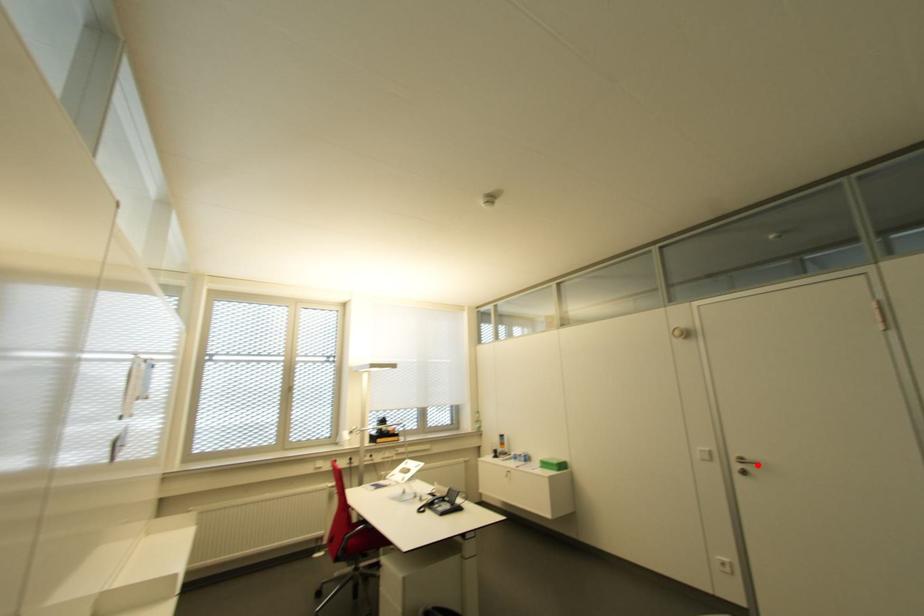
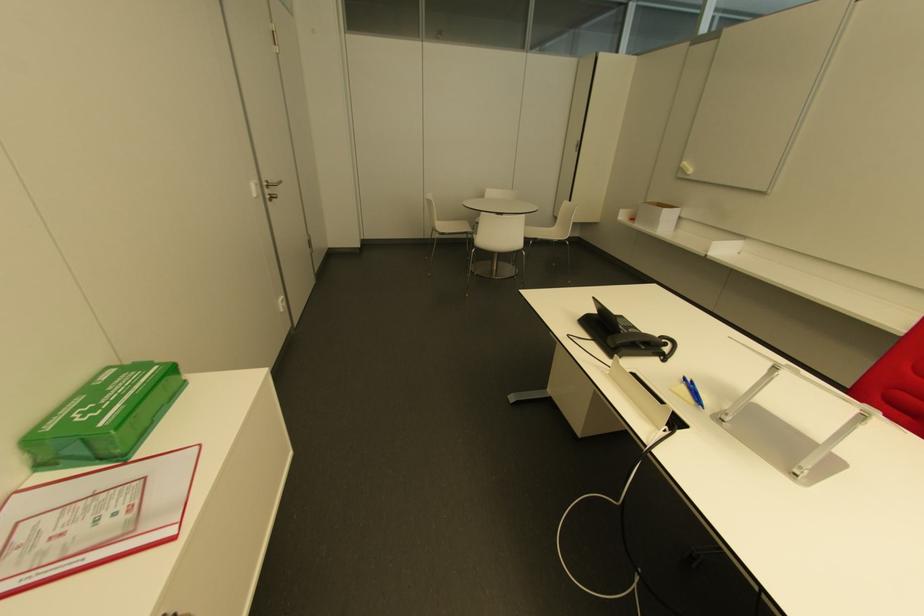
Locate, in the second image, the point that corresponds to the highlighted location in the first image.

(278, 182)